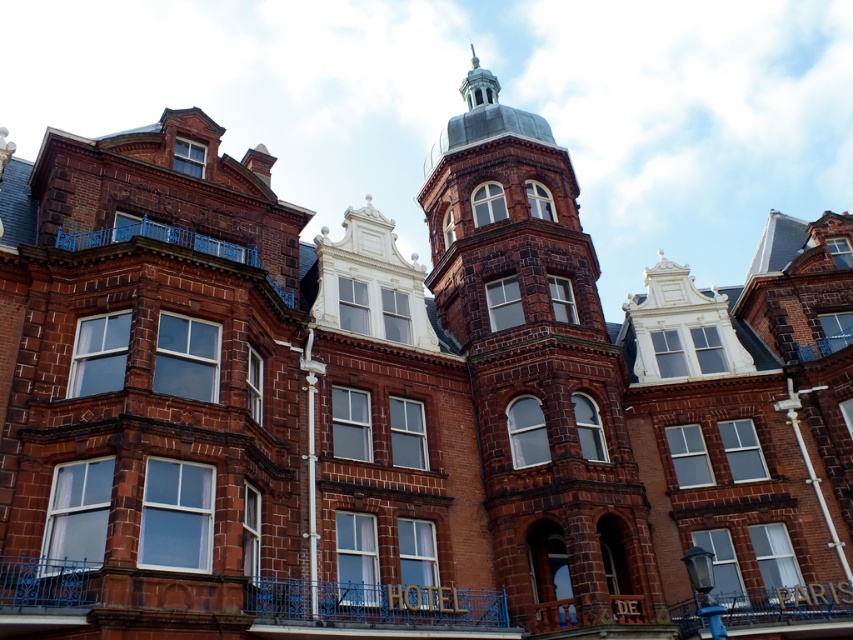
Is the position of smooth brick bell tower at center more distant than that of polished silver spire at upper center?

That is False.

Can you confirm if smooth brick bell tower at center is bigger than polished silver spire at upper center?

Incorrect, smooth brick bell tower at center is not larger than polished silver spire at upper center.

Is point (514, 403) closer to viewer compared to point (474, 97)?

Yes, it is in front of point (474, 97).

The width and height of the screenshot is (853, 640). I want to click on smooth brick bell tower at center, so click(x=540, y=380).